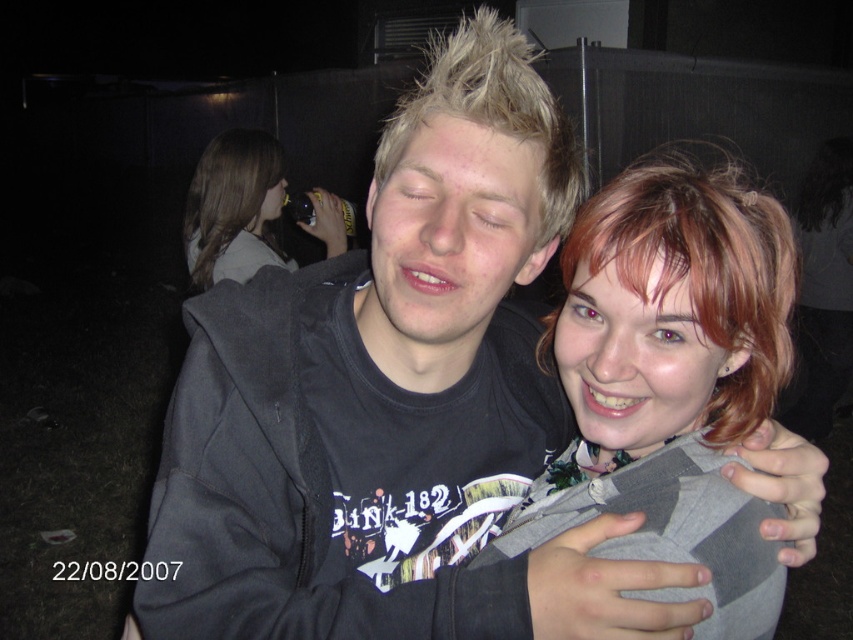
You are standing in front of the two people in the image. There are two points marked in the scene. Which point is nearer to you? The points are point (598, 307) and point (189, 234).

Point (598, 307) is closer to the viewer than point (189, 234).

You are trying to decide which object is wider between the matte gray hoodie at center and the brown hair at upper left. Based on the scene, which one is narrower?

The matte gray hoodie at center has a lesser width compared to brown hair at upper left, so the matte gray hoodie at center is narrower.

You are a photographer trying to capture a closeup of the matte gray hoodie at center and the brown hair at upper left in the image. Which object should you zoom in on first to ensure it fits entirely within the frame?

The matte gray hoodie at center should be zoomed in on first because it occupies less space than the brown hair at upper left, so it requires a closer focus to fit within the frame.